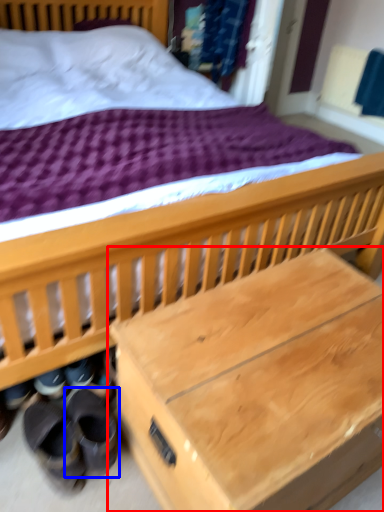
Question: Which point is closer to the camera, table (highlighted by a red box) or footwear (highlighted by a blue box)?

Choices:
 (A) table
 (B) footwear

Answer: (A)